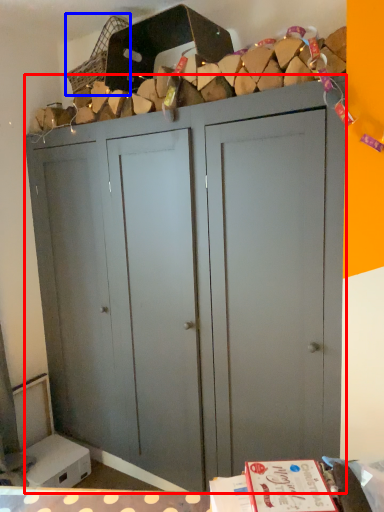
Question: Which point is closer to the camera, cupboard (highlighted by a red box) or basket (highlighted by a blue box)?

Choices:
 (A) cupboard
 (B) basket

Answer: (A)